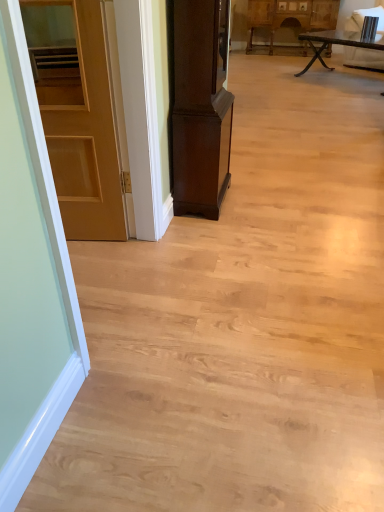
Question: From the image's perspective, is wooden rustic table at upper right below dark wood cabinet at center, acting as the 2th cabinetry starting from the top?

Choices:
 (A) no
 (B) yes

Answer: (A)

Question: Is wooden rustic table at upper right next to dark wood cabinet at center, acting as the 2th cabinetry starting from the top?

Choices:
 (A) no
 (B) yes

Answer: (A)

Question: Can you confirm if wooden rustic table at upper right is positioned to the right of dark wood cabinet at center, acting as the 1th cabinetry starting from the bottom?

Choices:
 (A) no
 (B) yes

Answer: (B)

Question: Does wooden rustic table at upper right lie behind dark wood cabinet at center, acting as the 2th cabinetry starting from the top?

Choices:
 (A) yes
 (B) no

Answer: (A)

Question: Would you consider wooden rustic table at upper right to be distant from dark wood cabinet at center, acting as the 1th cabinetry starting from the bottom?

Choices:
 (A) yes
 (B) no

Answer: (A)

Question: From a real-world perspective, relative to wooden rustic table at upper right, is wooden carved cabinet at upper center, acting as the first cabinetry starting from the back, vertically above or below?

Choices:
 (A) above
 (B) below

Answer: (A)

Question: Considering their positions, is wooden carved cabinet at upper center, acting as the first cabinetry starting from the back, located in front of or behind wooden rustic table at upper right?

Choices:
 (A) behind
 (B) front

Answer: (A)

Question: Is wooden carved cabinet at upper center, the 1th cabinetry positioned from the right, wider or thinner than wooden rustic table at upper right?

Choices:
 (A) wide
 (B) thin

Answer: (B)

Question: Based on their positions, is wooden carved cabinet at upper center, acting as the first cabinetry starting from the back, located to the left or right of wooden rustic table at upper right?

Choices:
 (A) left
 (B) right

Answer: (A)

Question: Is point (79, 202) closer or farther from the camera than point (372, 49)?

Choices:
 (A) farther
 (B) closer

Answer: (B)

Question: In terms of width, does matte wooden door at left look wider or thinner when compared to wooden rustic table at upper right?

Choices:
 (A) wide
 (B) thin

Answer: (B)

Question: In the image, is matte wooden door at left on the left side or the right side of wooden rustic table at upper right?

Choices:
 (A) left
 (B) right

Answer: (A)

Question: Is matte wooden door at left spatially inside wooden rustic table at upper right, or outside of it?

Choices:
 (A) outside
 (B) inside

Answer: (A)

Question: Is matte wooden door at left wider or thinner than wooden carved cabinet at upper center, acting as the first cabinetry starting from the back?

Choices:
 (A) wide
 (B) thin

Answer: (B)

Question: Considering the positions of matte wooden door at left and wooden carved cabinet at upper center, acting as the first cabinetry starting from the back, in the image, is matte wooden door at left taller or shorter than wooden carved cabinet at upper center, acting as the first cabinetry starting from the back,?

Choices:
 (A) short
 (B) tall

Answer: (B)